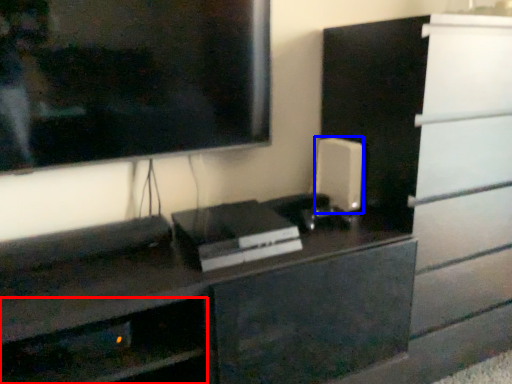
Question: Which point is further to the camera, shelf (highlighted by a red box) or appliance (highlighted by a blue box)?

Choices:
 (A) shelf
 (B) appliance

Answer: (B)